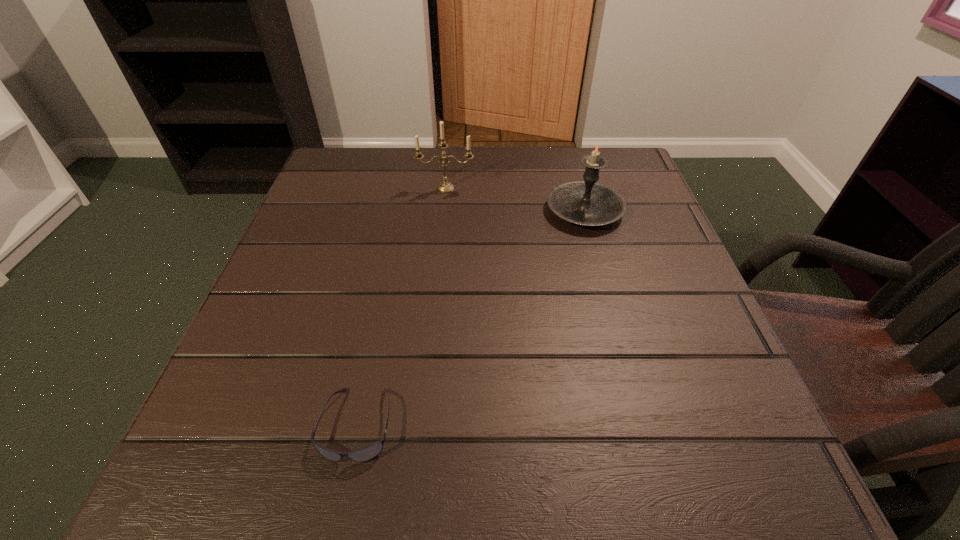
This screenshot has height=540, width=960. I want to click on the left candle, so click(x=445, y=186).

At what (x,y) coordinates should I click in order to perform the action: click on the right candle. Please return your answer as a coordinate pair (x, y). Looking at the image, I should click on (587, 202).

Locate an element on the screen. sunglasses is located at coordinates (366, 453).

Find the location of a particular element. the nearest object is located at coordinates (366, 453).

At what (x,y) coordinates should I click in order to perform the action: click on blank space located 0.110m on the right of the left candle. Please return your answer as a coordinate pair (x, y). Looking at the image, I should click on (521, 188).

Locate an element on the screen. vacant space positioned 0.060m on the back of the right candle is located at coordinates (574, 175).

This screenshot has width=960, height=540. In order to click on object that is positioned at the near edge in this screenshot , I will do (366, 453).

This screenshot has width=960, height=540. Find the location of `object present at the right edge`. object present at the right edge is located at coordinates (587, 202).

At what (x,y) coordinates should I click in order to perform the action: click on object at the far right corner. Please return your answer as a coordinate pair (x, y). Looking at the image, I should click on (587, 202).

In order to click on free spot at the far edge of the desktop in this screenshot , I will do `click(531, 165)`.